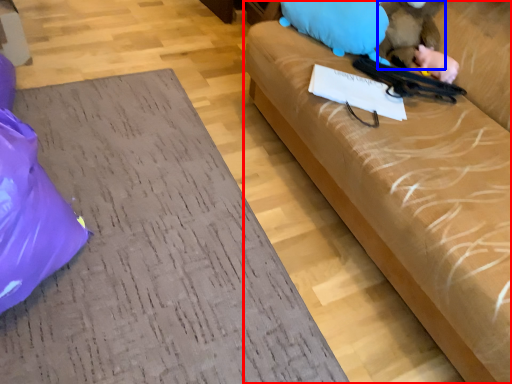
Question: Which point is closer to the camera, studio couch (highlighted by a red box) or animal (highlighted by a blue box)?

Choices:
 (A) studio couch
 (B) animal

Answer: (A)